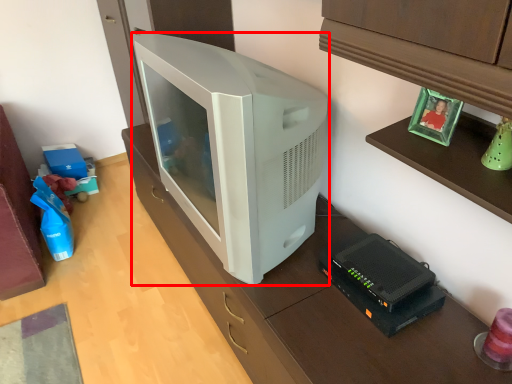
Question: Where is television (annotated by the red box) located in relation to appliance in the image?

Choices:
 (A) left
 (B) right

Answer: (A)